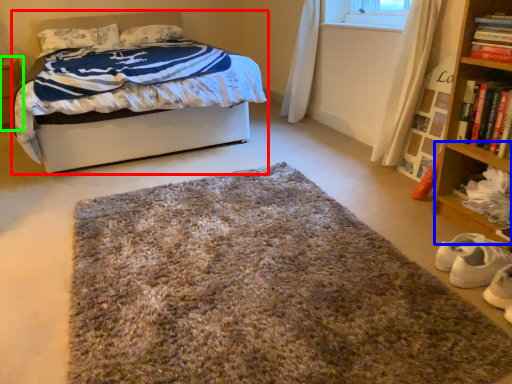
Question: Which object is positioned farthest from bed (highlighted by a red box)? Select from shelf (highlighted by a blue box) and nightstand (highlighted by a green box).

Choices:
 (A) shelf
 (B) nightstand

Answer: (A)